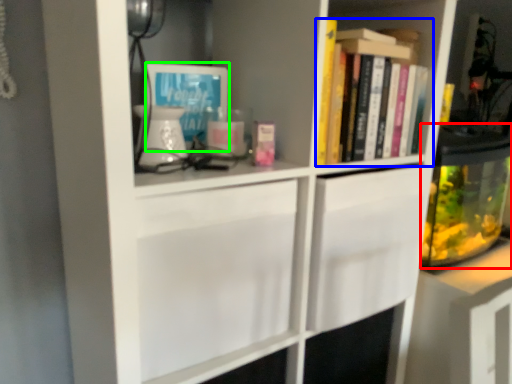
Question: Which is nearer to the glass jar (highlighted by a red box)? book (highlighted by a blue box) or book cover (highlighted by a green box).

Choices:
 (A) book
 (B) book cover

Answer: (A)